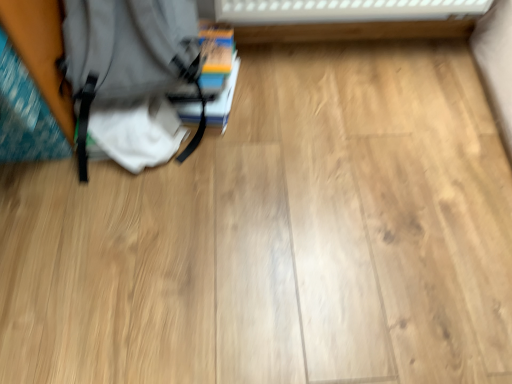
The width and height of the screenshot is (512, 384). In order to click on unoccupied area in front of matte gray backpack at left in this screenshot , I will do `click(137, 228)`.